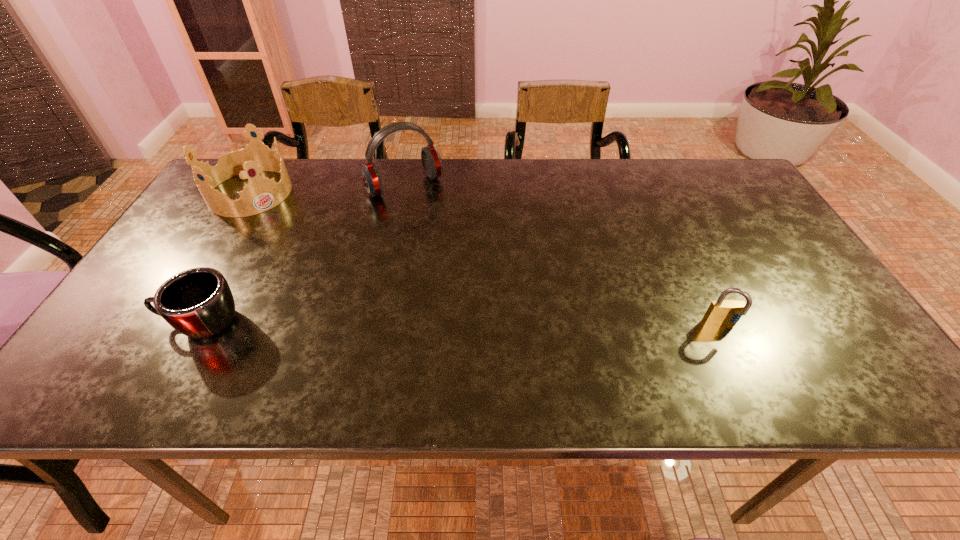
The image size is (960, 540). I want to click on mug, so click(198, 302).

At what (x,y) coordinates should I click in order to perform the action: click on padlock. Please return your answer as a coordinate pair (x, y). This screenshot has width=960, height=540. Looking at the image, I should click on (722, 312).

Where is `the tallest object`? the tallest object is located at coordinates (432, 163).

Locate an element on the screen. earphone is located at coordinates (432, 163).

This screenshot has height=540, width=960. Find the location of `tiara`. tiara is located at coordinates pos(261,194).

This screenshot has height=540, width=960. Find the location of `vacant space positioned on the side of the mug with the handle`. vacant space positioned on the side of the mug with the handle is located at coordinates (136, 322).

Find the location of a particular element. This screenshot has height=540, width=960. free space located 0.210m on the ear cups of the tallest object is located at coordinates (454, 244).

Locate an element on the screen. This screenshot has height=540, width=960. vacant space located on the ear cups of the tallest object is located at coordinates (480, 278).

This screenshot has width=960, height=540. I want to click on free space located on the ear cups of the tallest object, so click(x=445, y=233).

Locate an element on the screen. The height and width of the screenshot is (540, 960). vacant space located on the front-facing side of the tiara is located at coordinates (289, 230).